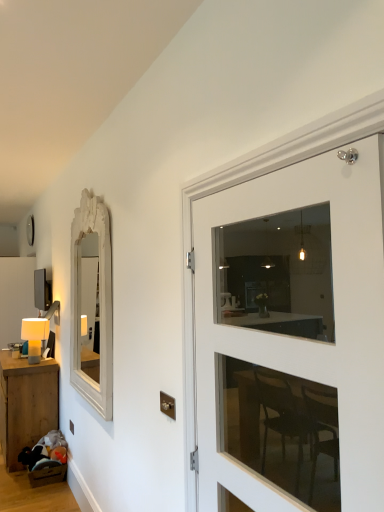
This screenshot has width=384, height=512. What do you see at coordinates (26, 404) in the screenshot? I see `wooden table at lower left` at bounding box center [26, 404].

Measure the distance between point (40,399) and camera.

A distance of 3.91 meters exists between point (40,399) and camera.

The width and height of the screenshot is (384, 512). Describe the element at coordinates (302, 339) in the screenshot. I see `white glass door at right` at that location.

Where is `white glass door at right`? white glass door at right is located at coordinates (302, 339).

Locate an element on the screen. This screenshot has width=384, height=512. matte white table lamp at left is located at coordinates (34, 336).

Where is `white carved wood mirror at left`? white carved wood mirror at left is located at coordinates (101, 304).

Locate an element on the screen. The width and height of the screenshot is (384, 512). wooden table at lower left is located at coordinates (26, 404).

In the scene shown: Which object is wider, matte white table lamp at left or white carved wood mirror at left?

matte white table lamp at left is wider.

Which is nearer, (31, 323) or (93, 400)?

The point (93, 400) is closer to the camera.

Would you say matte white table lamp at left is a long distance from white carved wood mirror at left?

Absolutely, matte white table lamp at left is distant from white carved wood mirror at left.

In the image, is matte white table lamp at left on the left side or the right side of white carved wood mirror at left?

Clearly, matte white table lamp at left is on the left of white carved wood mirror at left in the image.

How many degrees apart are the facing directions of white carved wood mirror at left and wooden table at lower left?

They differ by 0.143 degrees in their facing directions.

Is white carved wood mirror at left looking in the opposite direction of wooden table at lower left?

That's not correct — white carved wood mirror at left is not looking away from wooden table at lower left.

Is white carved wood mirror at left bigger than wooden table at lower left?

Incorrect, white carved wood mirror at left is not larger than wooden table at lower left.

From a real-world perspective, between white carved wood mirror at left and wooden table at lower left, who is vertically lower?

wooden table at lower left is physically lower.

Looking at this image, is white carved wood mirror at left not within matte white table lamp at left?

Yes, white carved wood mirror at left is located beyond the bounds of matte white table lamp at left.

Looking at their sizes, would you say white carved wood mirror at left is wider or thinner than matte white table lamp at left?

Clearly, white carved wood mirror at left has less width compared to matte white table lamp at left.

From the image's perspective, which object appears higher, white carved wood mirror at left or matte white table lamp at left?

white carved wood mirror at left.

From a real-world perspective, between white carved wood mirror at left and matte white table lamp at left, who is vertically higher?

white carved wood mirror at left.

Is wooden table at lower left facing away from white glass door at right?

wooden table at lower left is not turned away from white glass door at right.

Is wooden table at lower left at the left side of white glass door at right?

Indeed, wooden table at lower left is positioned on the left side of white glass door at right.

Considering the relative sizes of wooden table at lower left and white glass door at right in the image provided, is wooden table at lower left wider than white glass door at right?

Indeed, wooden table at lower left has a greater width compared to white glass door at right.

Looking at the image, does wooden table at lower left seem bigger or smaller compared to white glass door at right?

In the image, wooden table at lower left appears to be larger than white glass door at right.

Where is `door to the right of wooden table at lower left`? door to the right of wooden table at lower left is located at coordinates (302, 339).

In terms of height, does white glass door at right look taller or shorter compared to wooden table at lower left?

Considering their sizes, white glass door at right has more height than wooden table at lower left.

Is white glass door at right bigger than wooden table at lower left?

Incorrect, white glass door at right is not larger than wooden table at lower left.

Does point (250, 332) come behind point (18, 381)?

No, it is in front of (18, 381).

From a real-world perspective, is matte white table lamp at left positioned over white glass door at right based on gravity?

No.

From the image's perspective, is matte white table lamp at left on white glass door at right?

No, from the image's perspective, matte white table lamp at left is not on top of white glass door at right.

Is matte white table lamp at left further to the viewer compared to white glass door at right?

Yes, the depth of matte white table lamp at left is greater than that of white glass door at right.

Does matte white table lamp at left turn towards wooden table at lower left?

No, matte white table lamp at left is not turned towards wooden table at lower left.

From the image's perspective, would you say matte white table lamp at left is positioned over wooden table at lower left?

Yes, from the image's perspective, matte white table lamp at left is over wooden table at lower left.

What's the angular difference between matte white table lamp at left and wooden table at lower left's facing directions?

They differ by 2.42 degrees in their facing directions.

From a real-world perspective, is matte white table lamp at left physically above wooden table at lower left?

Yes.

Where is `table lamp behind the white carved wood mirror at left`? This screenshot has height=512, width=384. table lamp behind the white carved wood mirror at left is located at coordinates (34, 336).

This screenshot has height=512, width=384. Identify the location of table below the white carved wood mirror at left (from a real-world perspective). (26, 404).

Estimate the real-world distances between objects in this image. Which object is closer to wooden table at lower left, white carved wood mirror at left or matte white table lamp at left?

The object closer to wooden table at lower left is matte white table lamp at left.

When comparing their distances from matte white table lamp at left, does white glass door at right or white carved wood mirror at left seem further?

white glass door at right is further to matte white table lamp at left.

Which object lies nearer to the anchor point matte white table lamp at left, wooden table at lower left or white carved wood mirror at left?

wooden table at lower left.

Estimate the real-world distances between objects in this image. Which object is further from white glass door at right, wooden table at lower left or white carved wood mirror at left?

Among the two, wooden table at lower left is located further to white glass door at right.

Which object lies further to the anchor point wooden table at lower left, white carved wood mirror at left or white glass door at right?

Based on the image, white glass door at right appears to be further to wooden table at lower left.

Based on the photo, from the image, which object appears to be nearer to white carved wood mirror at left, matte white table lamp at left or wooden table at lower left?

wooden table at lower left.

Based on their spatial positions, is matte white table lamp at left or white carved wood mirror at left closer to wooden table at lower left?

matte white table lamp at left is positioned closer to the anchor wooden table at lower left.

From the image, which object appears to be nearer to wooden table at lower left, white glass door at right or white carved wood mirror at left?

The object closer to wooden table at lower left is white carved wood mirror at left.

At what (x,y) coordinates should I click in order to perform the action: click on mirror between white glass door at right and matte white table lamp at left from front to back. Please return your answer as a coordinate pair (x, y). Looking at the image, I should click on (101, 304).

Identify the location of mirror located between white glass door at right and wooden table at lower left in the depth direction. Image resolution: width=384 pixels, height=512 pixels. (101, 304).

Where is `table between white carved wood mirror at left and matte white table lamp at left from front to back`? Image resolution: width=384 pixels, height=512 pixels. table between white carved wood mirror at left and matte white table lamp at left from front to back is located at coordinates (26, 404).

I want to click on table positioned between white glass door at right and matte white table lamp at left from near to far, so (26, 404).